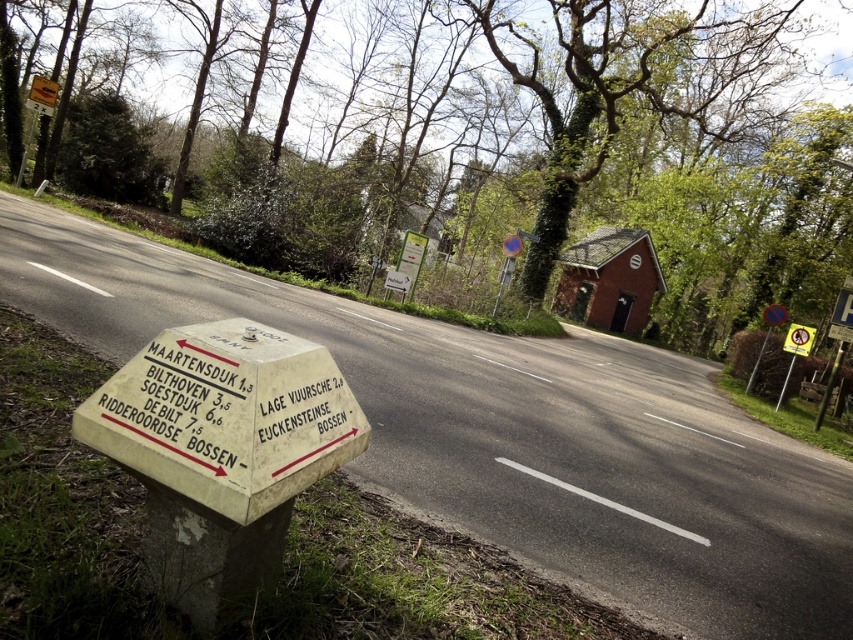
Question: Which of the following is the farthest from the observer?

Choices:
 (A) white plastic signpost at lower left
 (B) green leafy tree at upper center
 (C) yellow plastic sign at center

Answer: (B)

Question: Among these points, which one is farthest from the camera?

Choices:
 (A) [x=177, y=424]
 (B) [x=782, y=342]

Answer: (B)

Question: Which object is positioned farthest from the white plastic signpost at lower left?

Choices:
 (A) green wooden signpost at lower right
 (B) metallic reflective sign at upper right

Answer: (B)

Question: Is green leafy tree at upper center smaller than metallic reflective sign at upper right?

Choices:
 (A) no
 (B) yes

Answer: (A)

Question: Can you confirm if white plastic signpost at lower left is positioned to the left of yellow plastic sign at center?

Choices:
 (A) no
 (B) yes

Answer: (B)

Question: Is white plastic signpost at lower left wider than green wooden signpost at lower right?

Choices:
 (A) no
 (B) yes

Answer: (A)